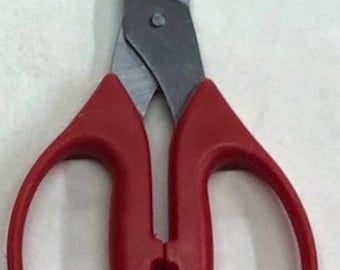
The height and width of the screenshot is (270, 340). What are the coordinates of `hinge` in the screenshot? It's located at (157, 19).